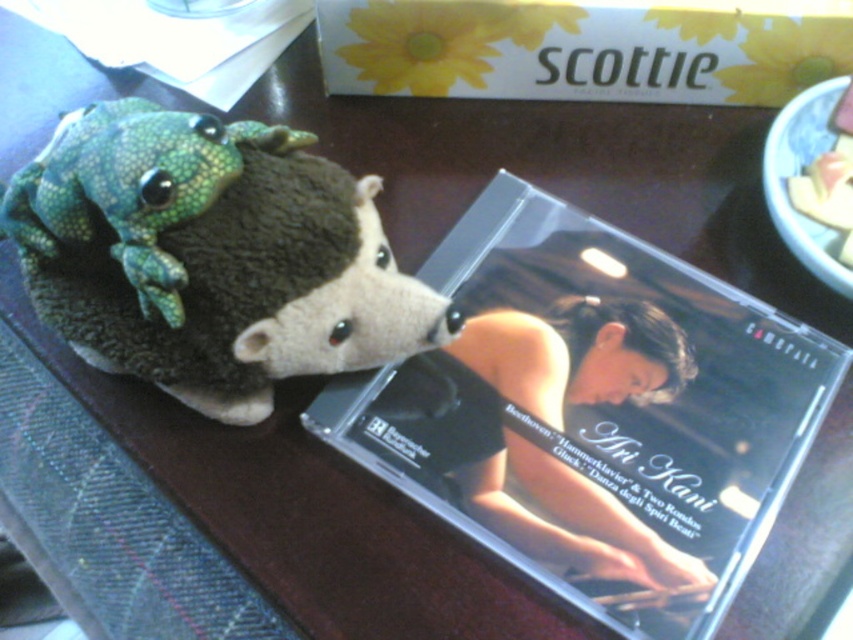
In the scene shown: Is clear plastic cd case at upper center further to camera compared to green fuzzy plush toy at upper left?

Yes, it is behind green fuzzy plush toy at upper left.

What do you see at coordinates (592, 413) in the screenshot?
I see `clear plastic cd case at upper center` at bounding box center [592, 413].

Is point (721, 292) farther from camera compared to point (323, 301)?

Yes, point (721, 292) is farther from viewer.

Where is `clear plastic cd case at upper center`? The image size is (853, 640). clear plastic cd case at upper center is located at coordinates (592, 413).

Is clear plastic cd case at upper center further to the viewer compared to green textured plush frog at upper left?

Yes, it is behind green textured plush frog at upper left.

The height and width of the screenshot is (640, 853). I want to click on clear plastic cd case at upper center, so click(592, 413).

Is point (436, 502) positioned in front of point (125, 109)?

No, (436, 502) is behind (125, 109).

This screenshot has height=640, width=853. I want to click on clear plastic cd case at upper center, so click(x=592, y=413).

I want to click on green fuzzy plush toy at upper left, so click(x=212, y=257).

Is green fuzzy plush toy at upper left further to camera compared to green textured plush frog at upper left?

That is True.

Which is behind, point (196, 268) or point (215, 170)?

The point (196, 268) is behind.

The width and height of the screenshot is (853, 640). I want to click on green fuzzy plush toy at upper left, so click(x=212, y=257).